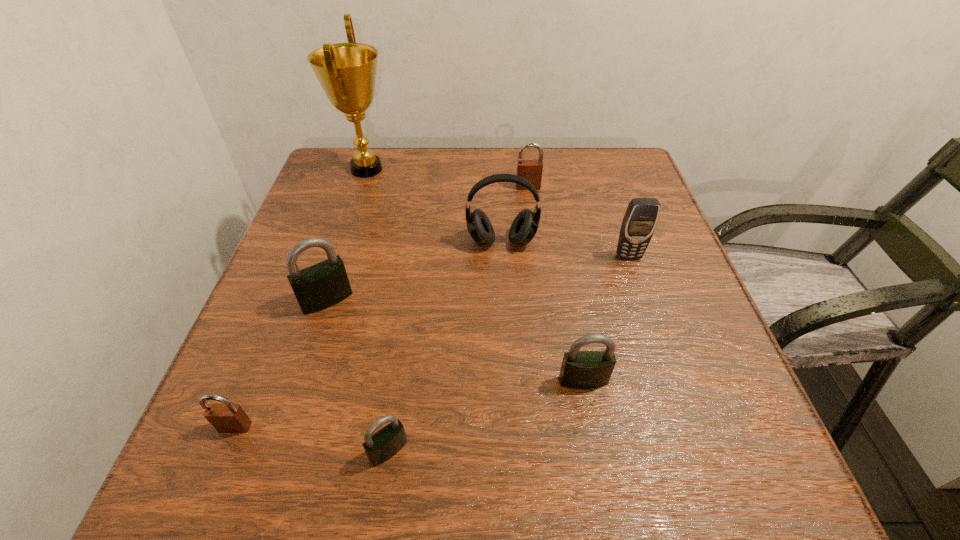
What are the coordinates of `vacant space that satisfies the following two spatial constraints: 1. on the front view with handles of the third nearest padlock; 2. on the right side of the award` in the screenshot? It's located at (298, 381).

You are a GUI agent. You are given a task and a screenshot of the screen. Output one action in this format:
    pyautogui.click(x=<x>, y=<y>)
    Task: Click on the free space that satisfies the following two spatial constraints: 1. on the ear cups of the headset; 2. on the right side of the sixth farthest object
    This screenshot has height=540, width=960.
    Given the screenshot: What is the action you would take?
    pyautogui.click(x=509, y=381)

Find the location of a particular element. The width and height of the screenshot is (960, 540). vacant space that satisfies the following two spatial constraints: 1. on the front-facing side of the second biggest black padlock; 2. on the left side of the farthest padlock is located at coordinates (554, 381).

This screenshot has height=540, width=960. Identify the location of vacant space that satisfies the following two spatial constraints: 1. on the front-facing side of the third farthest padlock; 2. on the left side of the right brown padlock. (554, 381).